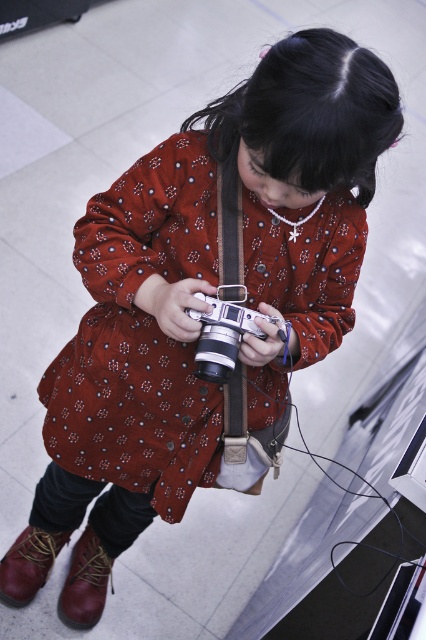
Question: Where is brown leather boot at lower left located in relation to leather boot at lower left in the image?

Choices:
 (A) below
 (B) above

Answer: (A)

Question: Based on their relative distances, which object is nearer to the brown leather boot at lower left?

Choices:
 (A) leather boot at lower left
 (B) silver metallic camera at center

Answer: (A)

Question: Considering the real-world distances, which object is farthest from the silver metallic camera at center?

Choices:
 (A) brown leather boot at lower left
 (B) leather boot at lower left

Answer: (A)

Question: Where is brown leather boot at lower left located in relation to leather boot at lower left in the image?

Choices:
 (A) right
 (B) left

Answer: (A)

Question: Does brown leather boot at lower left appear on the right side of leather boot at lower left?

Choices:
 (A) yes
 (B) no

Answer: (A)

Question: Estimate the real-world distances between objects in this image. Which object is closer to the brown leather boot at lower left?

Choices:
 (A) leather boot at lower left
 (B) silver metallic camera at center

Answer: (A)